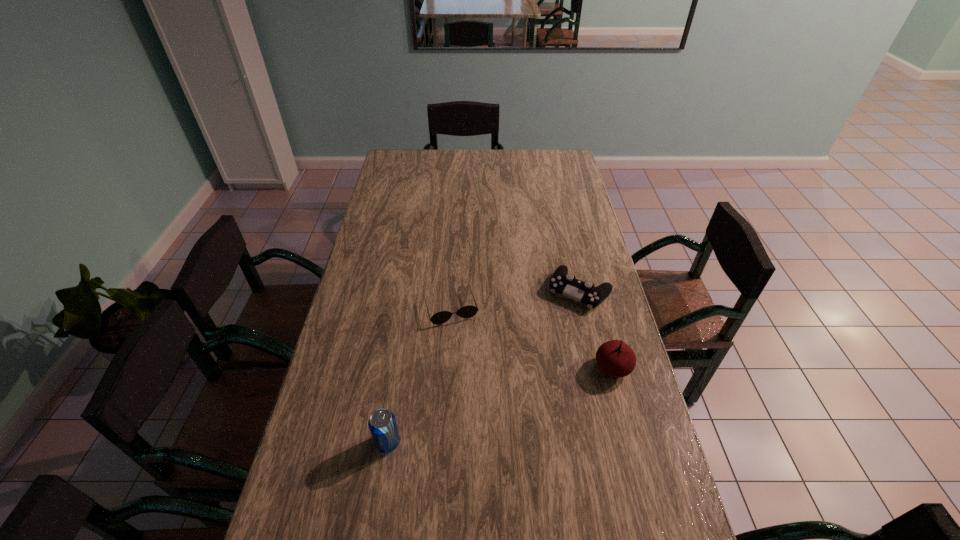
You are a GUI agent. You are given a task and a screenshot of the screen. Output one action in this format:
    pyautogui.click(x=<x>, y=<y>)
    Task: Click on the vacant region located 0.250m on the front-facing side of the second object from left to right
    Image resolution: width=960 pixels, height=540 pixels.
    Given the screenshot: What is the action you would take?
    pyautogui.click(x=477, y=393)

The image size is (960, 540). In order to click on vacant space located on the front-facing side of the second object from left to right in this screenshot , I will do `click(466, 353)`.

Identify the location of vacant region located 0.400m on the surface of the control. This screenshot has height=540, width=960. (505, 402).

Find the location of `vacant space located on the surface of the control`. vacant space located on the surface of the control is located at coordinates (507, 399).

Identify the location of free space located 0.270m on the surface of the control. The width and height of the screenshot is (960, 540). (528, 368).

Locate an element on the screen. This screenshot has height=540, width=960. tomato that is at the right edge is located at coordinates (615, 358).

Identify the location of control at the right edge. (562, 282).

The image size is (960, 540). Find the location of `free region at the far edge of the desktop`. free region at the far edge of the desktop is located at coordinates (496, 166).

In the image, there is a desktop. Where is `blank space at the left edge`? The height and width of the screenshot is (540, 960). blank space at the left edge is located at coordinates (368, 303).

Find the location of a particular element. vacant space at the right edge of the desktop is located at coordinates (608, 396).